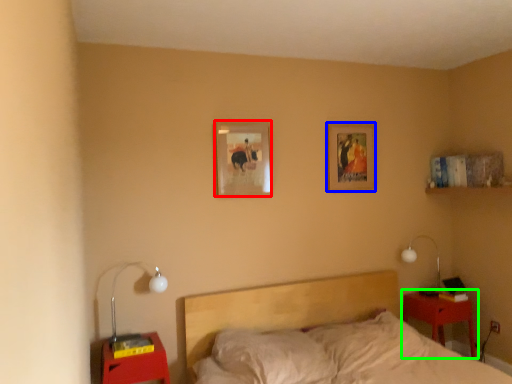
Question: Which is farther away from picture frame (highlighted by a red box)? picture frame (highlighted by a blue box) or nightstand (highlighted by a green box)?

Choices:
 (A) picture frame
 (B) nightstand

Answer: (B)